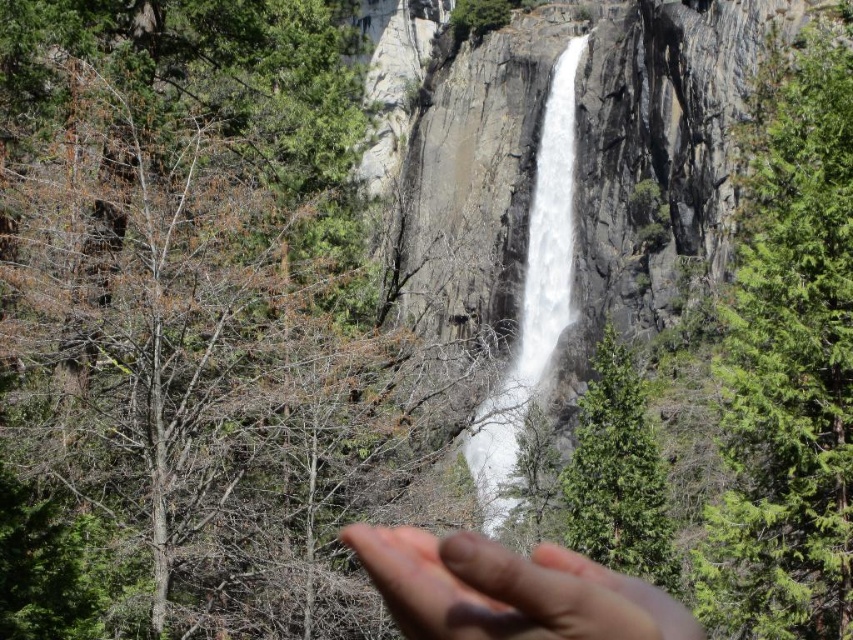
You are a photographer standing at the base of the waterfall. You notice two elements in the scene described as skinny flesh at center and white frothy water at center. Based on their positions, which one is closer to you?

The skinny flesh at center is positioned under the white frothy water at center, meaning it is closer to you since it is below the water.

You are a photographer standing at the edge of the cliff where the waterfall is. You notice a point marked at coordinates (x=508, y=589) in the image. Based on the scene description, what object or feature is located at that point?

The point at coordinates (x=508, y=589) marks the location of the skinny flesh, which is the hand in the lower right corner of the image.

You are a photographer trying to capture the waterfall scene. You notice a skinny flesh at center in the image. Where exactly is this object located in the image coordinates?

The skinny flesh at center is located at point coordinates of (x=508, y=589).